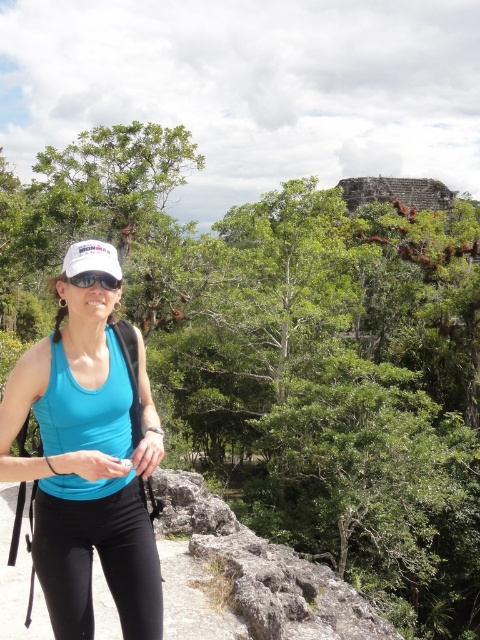
Between blue fabric tank top at center and matte black goggles at center, which one has less height?

matte black goggles at center is shorter.

Is blue fabric tank top at center below matte black goggles at center?

Indeed, blue fabric tank top at center is positioned under matte black goggles at center.

Between point (50, 444) and point (119, 284), which one is positioned behind?

Positioned behind is point (119, 284).

This screenshot has height=640, width=480. I want to click on blue fabric tank top at center, so click(x=86, y=406).

Which of these two, black matte leggings at lower left or matte black goggles at center, stands shorter?

Standing shorter between the two is matte black goggles at center.

Is point (51, 612) less distant than point (78, 278)?

Yes, point (51, 612) is in front of point (78, 278).

In order to click on black matte leggings at lower left in this screenshot , I will do `click(99, 560)`.

Which is below, black matte leggings at lower left or blue fabric tank top at center?

black matte leggings at lower left is below.

Describe the element at coordinates (99, 560) in the screenshot. I see `black matte leggings at lower left` at that location.

This screenshot has height=640, width=480. Find the location of `black matte leggings at lower left`. black matte leggings at lower left is located at coordinates (99, 560).